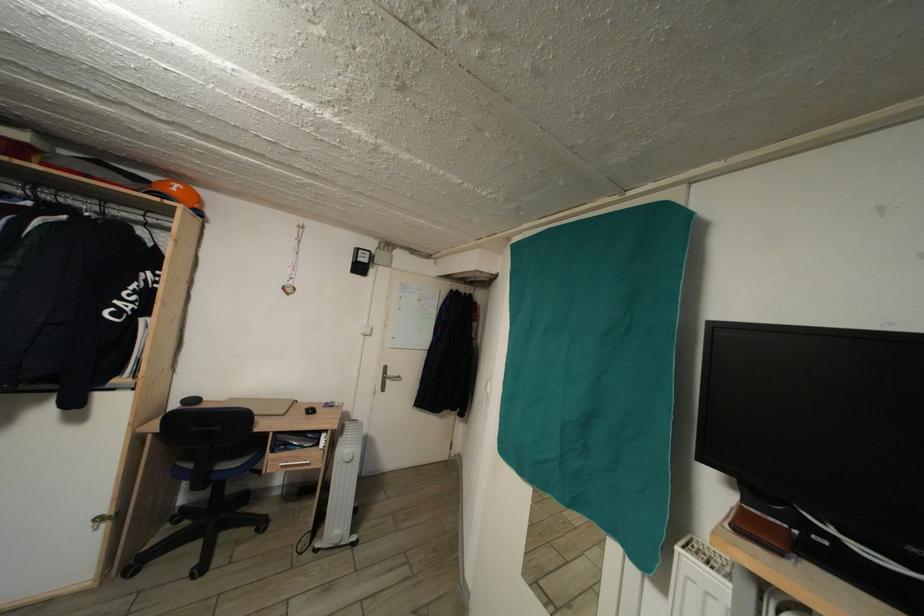
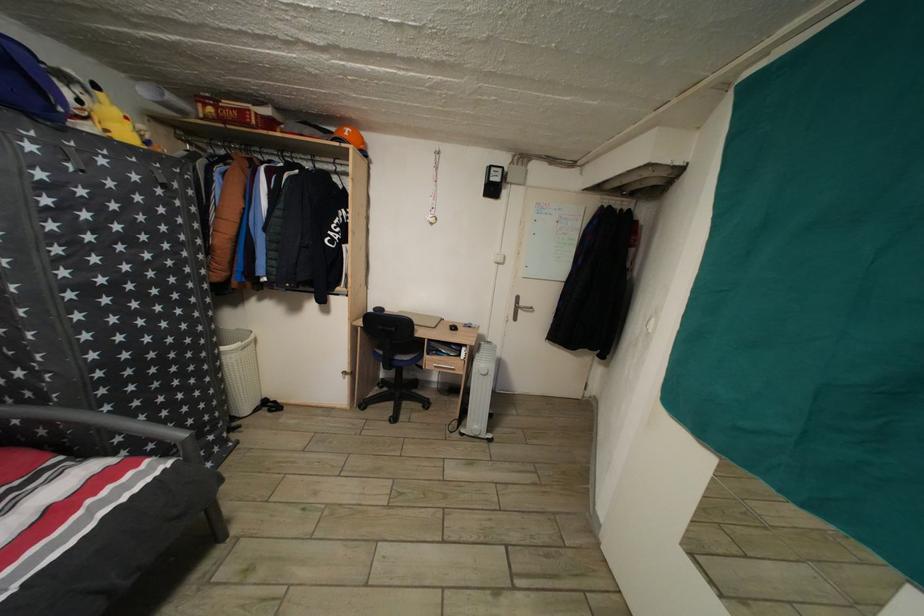
Question: The first image is from the beginning of the video and the second image is from the end. How did the camera likely rotate when shooting the video?

Choices:
 (A) Left
 (B) Right
 (C) Up
 (D) Down

Answer: (A)